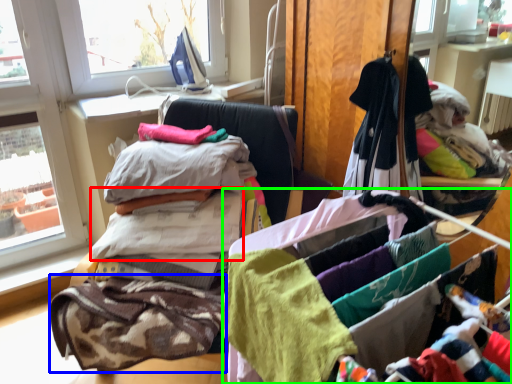
Question: Which is farther away from baby clothe (highlighted by a red box)? baby clothe (highlighted by a blue box) or material (highlighted by a green box)?

Choices:
 (A) baby clothe
 (B) material

Answer: (B)